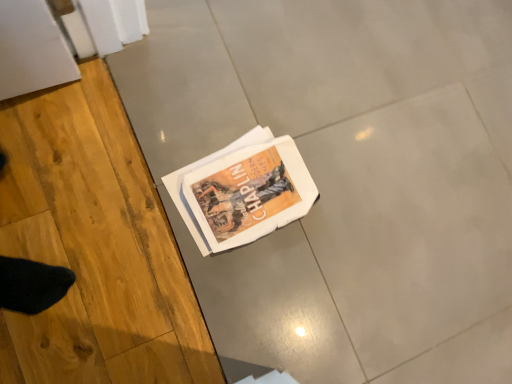
The image size is (512, 384). Find the location of `free space to the back side of orange paper magazine at center`. free space to the back side of orange paper magazine at center is located at coordinates (313, 115).